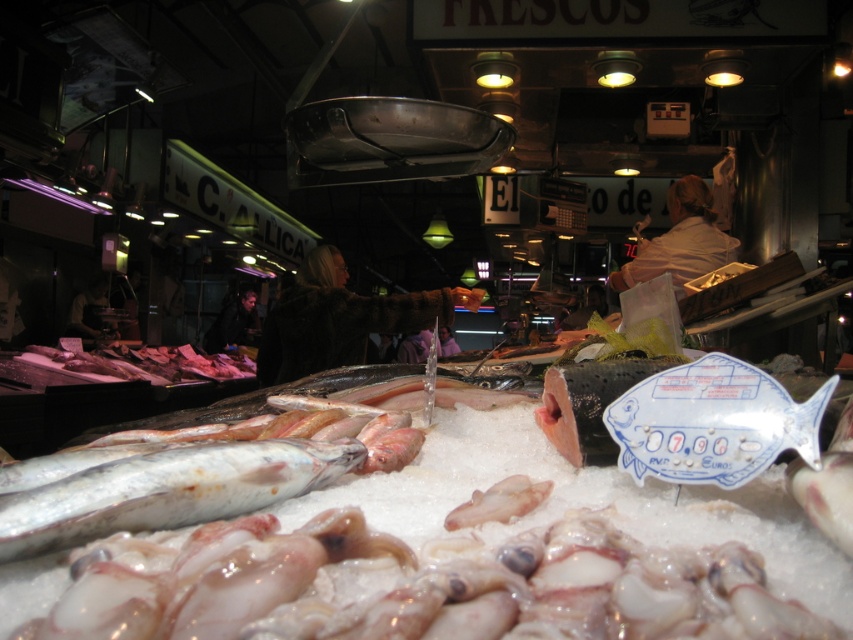
You are a customer at the fish market and want to buy both the translucent white fish at center and the translucent pinkish flesh at center. Which one is positioned to the left?

The translucent white fish at center is to the left of the translucent pinkish flesh at center.

Based on the photo, you are a customer at the fish market and want to locate two specific points marked on the floor. The first point is at coordinates point (94, 504) and the second is at point (532, 490). From your current position, which point is closer to you?

Answer: Point (94, 504) is in front of point (532, 490), so the first point is closer to you.